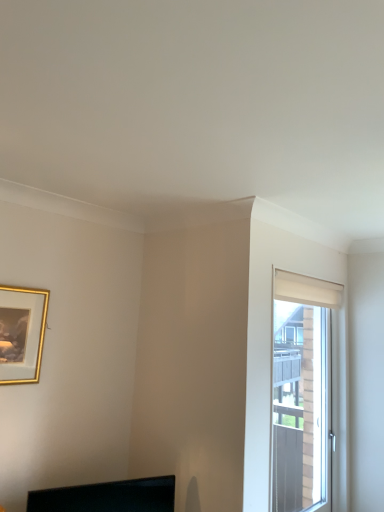
Question: Is black glossy monitor at lower center oriented away from gold-framed picture at upper left?

Choices:
 (A) no
 (B) yes

Answer: (A)

Question: Is black glossy monitor at lower center wider than gold-framed picture at upper left?

Choices:
 (A) yes
 (B) no

Answer: (A)

Question: Considering the relative positions of black glossy monitor at lower center and gold-framed picture at upper left in the image provided, is black glossy monitor at lower center in front of gold-framed picture at upper left?

Choices:
 (A) yes
 (B) no

Answer: (A)

Question: From the image's perspective, is black glossy monitor at lower center below gold-framed picture at upper left?

Choices:
 (A) no
 (B) yes

Answer: (B)

Question: Is black glossy monitor at lower center oriented towards gold-framed picture at upper left?

Choices:
 (A) no
 (B) yes

Answer: (A)

Question: Is black glossy monitor at lower center in contact with gold-framed picture at upper left?

Choices:
 (A) yes
 (B) no

Answer: (B)

Question: Does gold-framed picture at upper left contain white matte window at right?

Choices:
 (A) yes
 (B) no

Answer: (B)

Question: Is gold-framed picture at upper left positioned far away from white matte window at right?

Choices:
 (A) yes
 (B) no

Answer: (A)

Question: Is gold-framed picture at upper left to the right of white matte window at right from the viewer's perspective?

Choices:
 (A) no
 (B) yes

Answer: (A)

Question: Considering the relative sizes of gold-framed picture at upper left and white matte window at right in the image provided, is gold-framed picture at upper left bigger than white matte window at right?

Choices:
 (A) yes
 (B) no

Answer: (B)

Question: Is the depth of gold-framed picture at upper left greater than that of white matte window at right?

Choices:
 (A) no
 (B) yes

Answer: (A)

Question: From the image's perspective, is gold-framed picture at upper left above white matte window at right?

Choices:
 (A) no
 (B) yes

Answer: (B)

Question: Can you confirm if white matte window at right is taller than black glossy monitor at lower center?

Choices:
 (A) yes
 (B) no

Answer: (A)